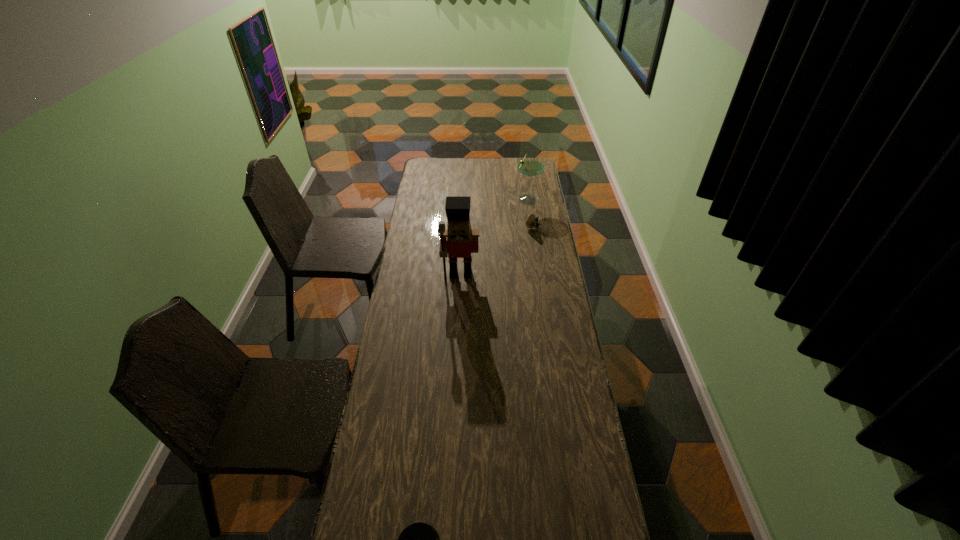
The width and height of the screenshot is (960, 540). Identify the location of avocado at the right edge. (532, 222).

Where is `vacant space at the far edge`? The width and height of the screenshot is (960, 540). vacant space at the far edge is located at coordinates (452, 159).

In the image, there is a desktop. At what (x,y) coordinates should I click in order to perform the action: click on vacant space at the left edge. Please return your answer as a coordinate pair (x, y). This screenshot has width=960, height=540. Looking at the image, I should click on (444, 186).

Find the location of a particular element. The image size is (960, 540). free location at the right edge of the desktop is located at coordinates (574, 348).

The width and height of the screenshot is (960, 540). Identify the location of vacant space at the far left corner of the desktop. (439, 167).

You are a GUI agent. You are given a task and a screenshot of the screen. Output one action in this format:
    pyautogui.click(x=<x>, y=<y>)
    Task: Click on the free space between the second shortest object and the nutcracker
    
    Given the screenshot: What is the action you would take?
    pyautogui.click(x=497, y=251)

Identify the location of vacant area that lies between the third farthest object and the martini. (494, 235).

Find the location of a particular element. The width and height of the screenshot is (960, 540). object identified as the second closest to the nutcracker is located at coordinates (530, 166).

Locate an element on the screen. object that stands as the second closest to the shortest object is located at coordinates (532, 222).